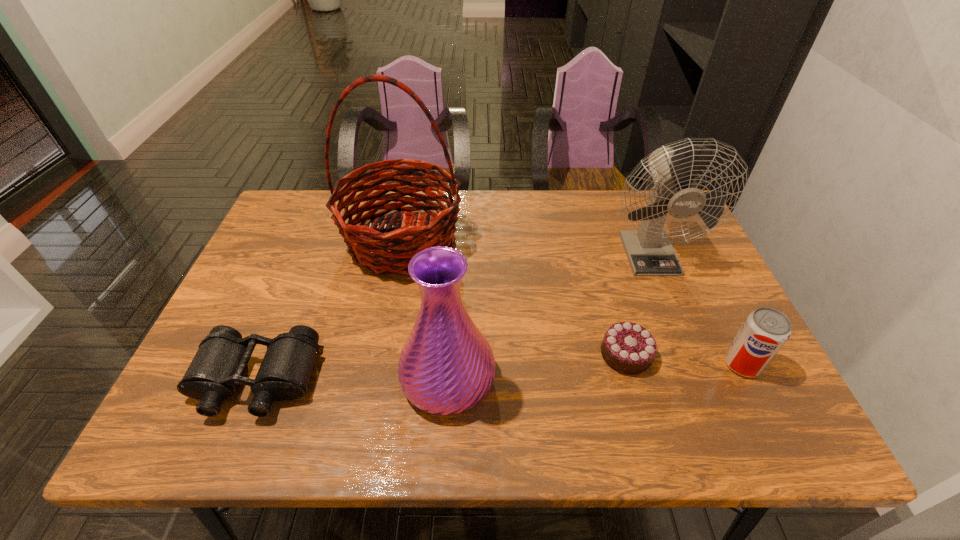
The image size is (960, 540). In order to click on basket in this screenshot , I will do `click(369, 245)`.

You are a GUI agent. You are given a task and a screenshot of the screen. Output one action in this format:
    pyautogui.click(x=<x>, y=<y>)
    Task: Click on the fan
    
    Given the screenshot: What is the action you would take?
    pyautogui.click(x=649, y=251)

The height and width of the screenshot is (540, 960). Find the location of `vase`. vase is located at coordinates (446, 367).

Where is `soda`? This screenshot has width=960, height=540. soda is located at coordinates (764, 332).

Identify the location of the second shortest object. (218, 366).

You are a GUI agent. You are given a task and a screenshot of the screen. Output one action in this format:
    pyautogui.click(x=<x>, y=<y>)
    Task: Click on the chocolate cake
    The image size is (960, 540).
    Given the screenshot: What is the action you would take?
    point(628,348)

What are the coordinates of `blank space located 0.200m on the front of the basket` in the screenshot? It's located at (382, 350).

What are the coordinates of `vacant region located on the air flow direction of the fan` in the screenshot? It's located at (683, 336).

You are a GUI agent. You are given a task and a screenshot of the screen. Output one action in this format:
    pyautogui.click(x=<x>, y=<y>)
    Task: Click on the free location located 0.140m on the right of the vase
    Image resolution: width=960 pixels, height=540 pixels.
    Given the screenshot: What is the action you would take?
    pyautogui.click(x=561, y=379)

This screenshot has height=540, width=960. Identify the location of vacant space located on the left of the soda. (564, 364).